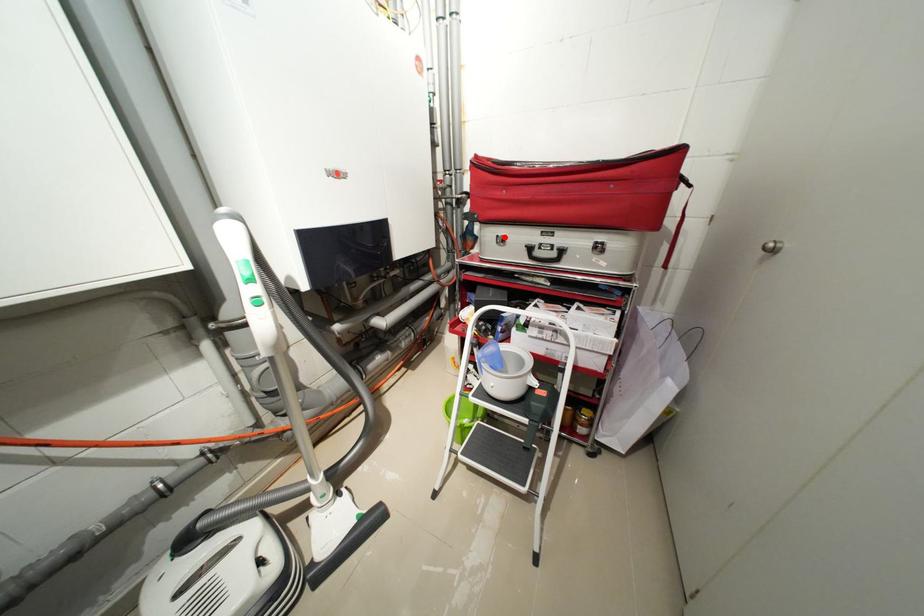
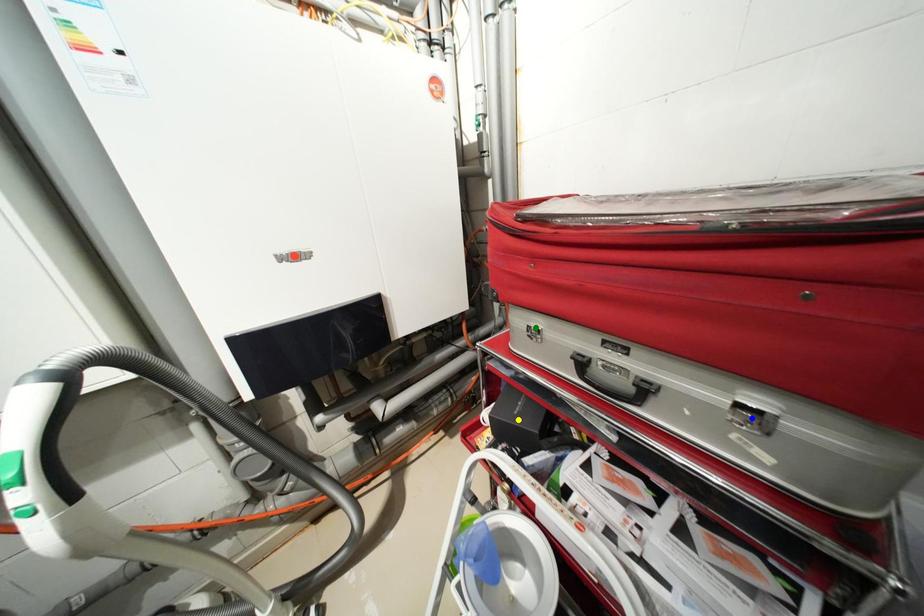
Question: I am providing you with two images of the same scene from different viewpoints. A red point is marked on the first image. You are given multiple points on the second image. Which point in image 2 is actually the same real-world point as the red point in image 1?

Choices:
 (A) yellow point
 (B) green point
 (C) blue point

Answer: (B)